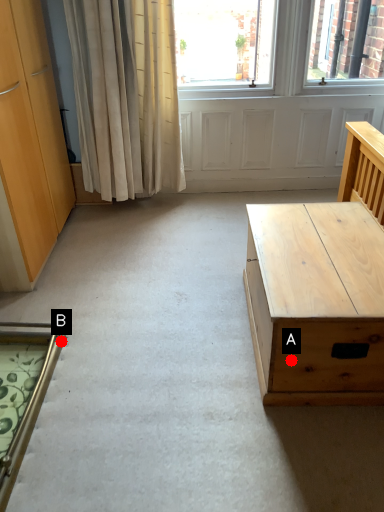
Question: Two points are circled on the image, labeled by A and B beside each circle. Which of the following is the closest to the observer?

Choices:
 (A) A is closer
 (B) B is closer

Answer: (A)